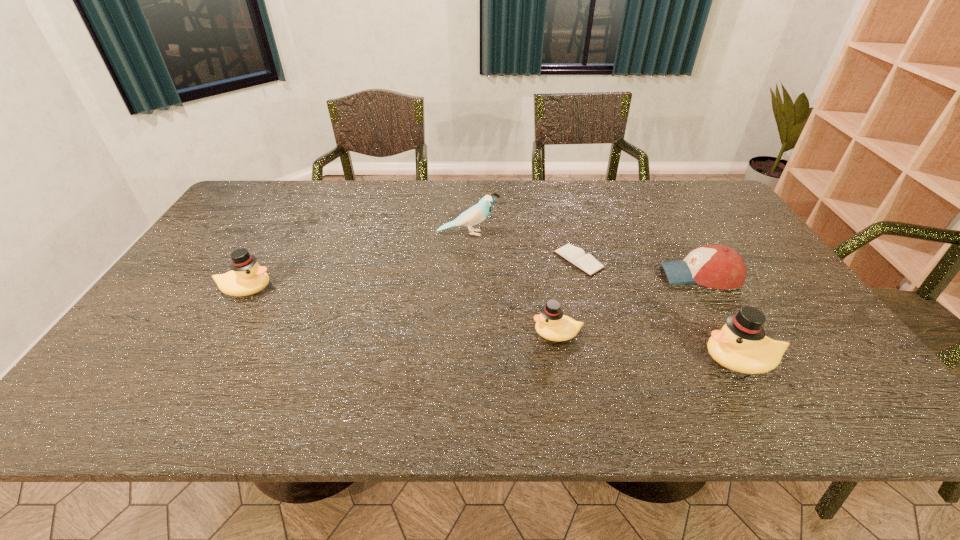
Locate an element on the screen. The image size is (960, 540). free point located 0.320m on the front-facing side of the shortest duck is located at coordinates (399, 333).

Where is `free region located 0.360m on the front-facing side of the shortest duck`? The image size is (960, 540). free region located 0.360m on the front-facing side of the shortest duck is located at coordinates (383, 333).

The image size is (960, 540). I want to click on vacant region located on the front-facing side of the rightmost duck, so click(x=643, y=360).

Locate an element on the screen. The width and height of the screenshot is (960, 540). vacant space located on the front-facing side of the rightmost duck is located at coordinates (534, 360).

Where is `vacant space located 0.130m on the front-facing side of the rightmost duck`? The height and width of the screenshot is (540, 960). vacant space located 0.130m on the front-facing side of the rightmost duck is located at coordinates (643, 360).

I want to click on vacant space located 0.070m at the face of the bird, so click(x=521, y=233).

At what (x,y) coordinates should I click in order to perform the action: click on blank space located 0.090m on the front-facing side of the baseball cap. Please return your answer as a coordinate pair (x, y). The height and width of the screenshot is (540, 960). Looking at the image, I should click on (629, 275).

In order to click on free space located on the front-facing side of the baseball cap in this screenshot , I will do `click(626, 275)`.

Locate an element on the screen. Image resolution: width=960 pixels, height=540 pixels. vacant point located 0.250m on the front-facing side of the baseball cap is located at coordinates (571, 275).

Locate an element on the screen. vacant space located 0.140m on the back of the shortest object is located at coordinates (567, 219).